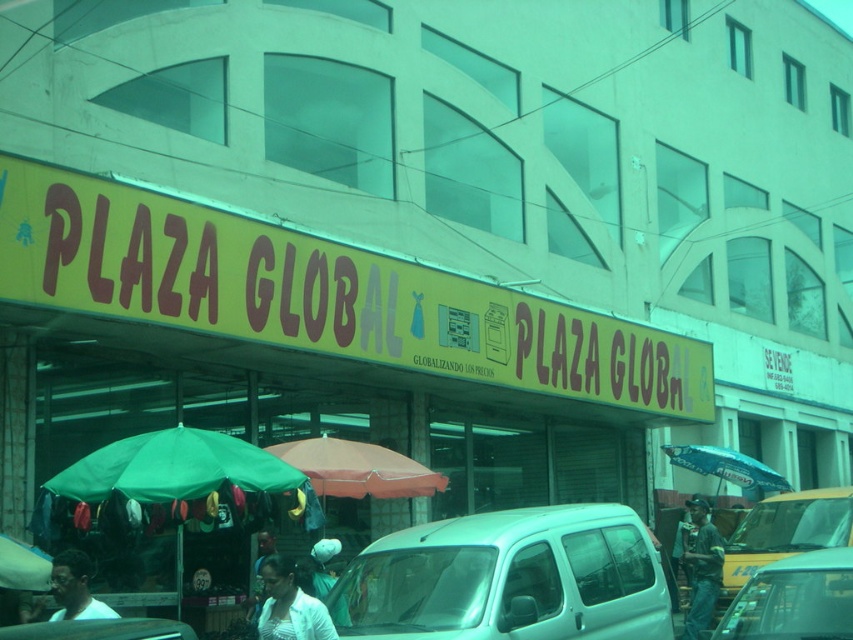
You are standing at the center of the bustling urban street scene in front of the PLAZA GLOBAL building. You see a point marked at coordinates (793, 600). What object is located at this point?

The point at coordinates (793, 600) marks a metallic silver car at lower right.

You are a pedestrian standing at the center of the street looking towards the PLAZA GLOBAL building. You see a metallic silver car at lower right and a white fabric shirt at lower center. Which object is positioned farther to the right from your perspective?

The metallic silver car at lower right is positioned to the right of the white fabric shirt at lower center, so the metallic silver car at lower right is farther to the right.